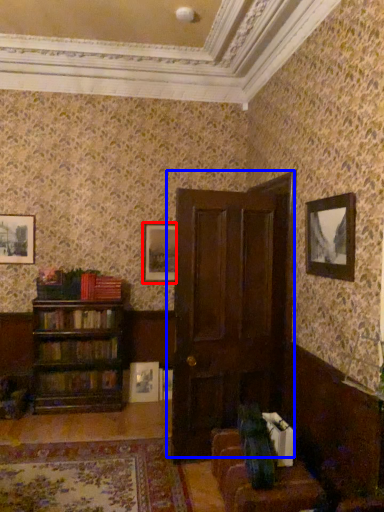
Question: Which object is further to the camera taking this photo, picture frame (highlighted by a red box) or door (highlighted by a blue box)?

Choices:
 (A) picture frame
 (B) door

Answer: (A)